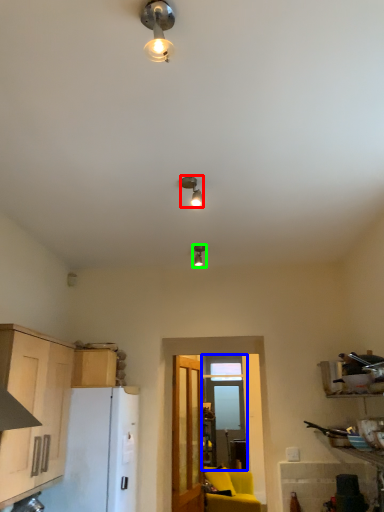
Question: Considering the real-world distances, which object is closest to lamp (highlighted by a red box)? window (highlighted by a blue box) or lamp (highlighted by a green box).

Choices:
 (A) window
 (B) lamp

Answer: (B)